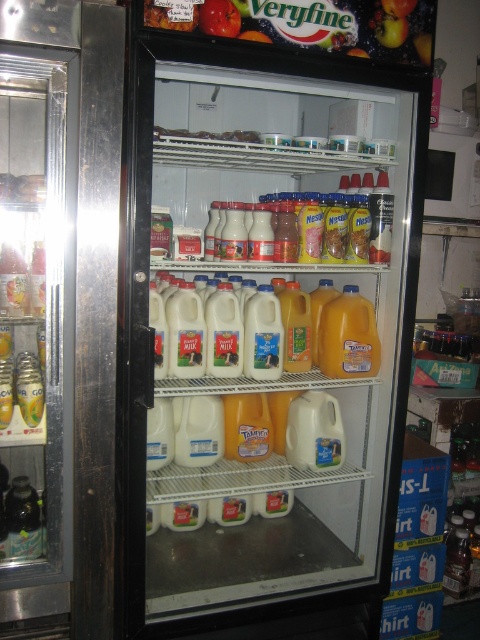
Question: Is white plastic milk jugs at center below translucent plastic jug at center right?

Choices:
 (A) yes
 (B) no

Answer: (B)

Question: Does white plastic milk jugs at center have a larger size compared to translucent plastic jug at center right?

Choices:
 (A) yes
 (B) no

Answer: (A)

Question: Is white plastic milk jugs at center further to the viewer compared to translucent plastic jug at center right?

Choices:
 (A) no
 (B) yes

Answer: (A)